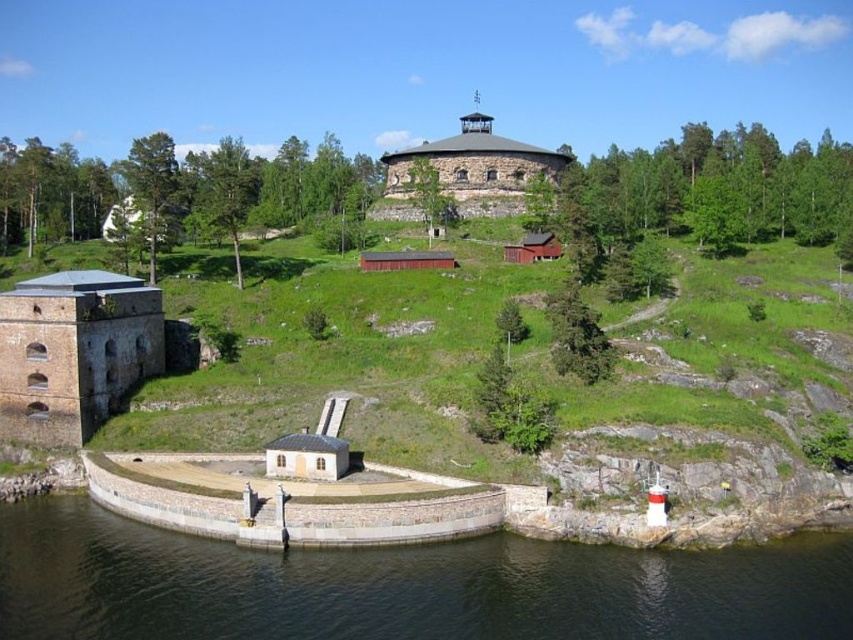
Can you confirm if transparent water at lower left is positioned below stone tower at center?

Indeed, transparent water at lower left is positioned under stone tower at center.

Measure the distance from transparent water at lower left to stone tower at center.

The distance of transparent water at lower left from stone tower at center is 261.22 feet.

This screenshot has width=853, height=640. Find the location of `transparent water at lower left`. transparent water at lower left is located at coordinates (402, 586).

At what (x,y) coordinates should I click in order to perform the action: click on transparent water at lower left. Please return your answer as a coordinate pair (x, y). This screenshot has height=640, width=853. Looking at the image, I should click on (402, 586).

Between point (138, 314) and point (549, 172), which one is positioned behind?

Point (549, 172)

Can you confirm if brown stone fort at lower left is shorter than stone tower at center?

Correct, brown stone fort at lower left is not as tall as stone tower at center.

I want to click on brown stone fort at lower left, so click(x=74, y=353).

Who is more forward, (13,531) or (96,394)?

Point (13,531) is more forward.

Can you confirm if transparent water at lower left is shorter than brown stone fort at lower left?

Correct, transparent water at lower left is not as tall as brown stone fort at lower left.

Does point (779, 627) come in front of point (61, 440)?

Yes, it is.

Identify the location of transparent water at lower left. (402, 586).